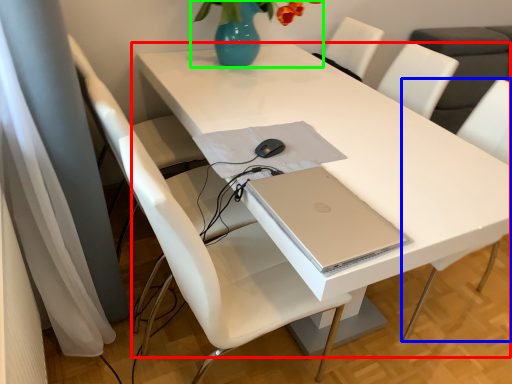
Question: Which is nearer to the table (highlighted by a red box)? chair (highlighted by a blue box) or floral arrangement (highlighted by a green box).

Choices:
 (A) chair
 (B) floral arrangement

Answer: (B)